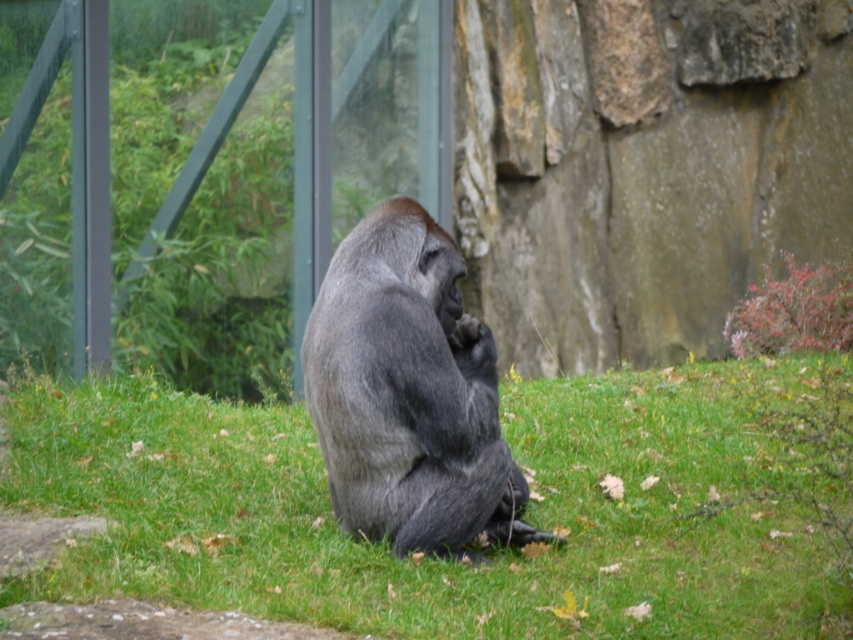
Is green soft grass at center thinner than gray fur gorilla at center?

No.

Can you confirm if green soft grass at center is taller than gray fur gorilla at center?

No.

Who is more distant from viewer, (345, 577) or (372, 518)?

The point (372, 518) is behind.

Identify the location of green soft grass at center. The width and height of the screenshot is (853, 640). [434, 557].